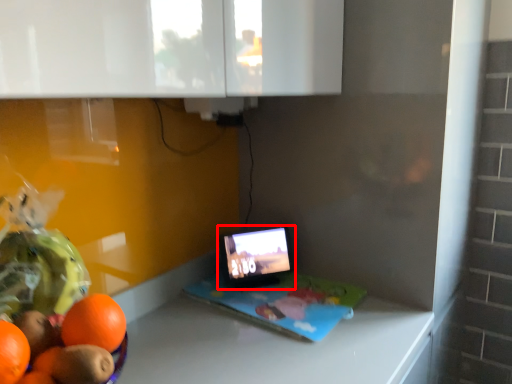
Question: From the image's perspective, what is the correct spatial positioning of tablet computer (annotated by the red box) in reference to laptop?

Choices:
 (A) below
 (B) above

Answer: (B)